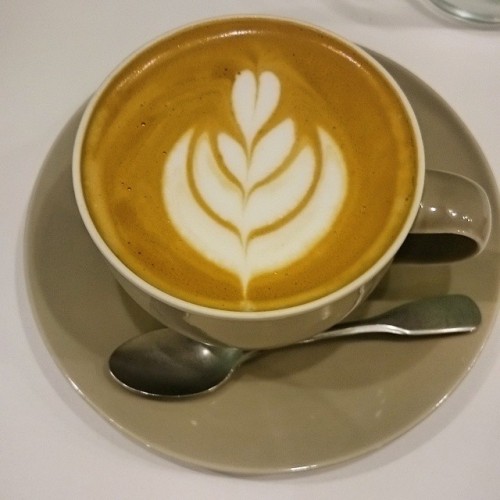
The height and width of the screenshot is (500, 500). I want to click on white inside of mug, so click(x=388, y=80).